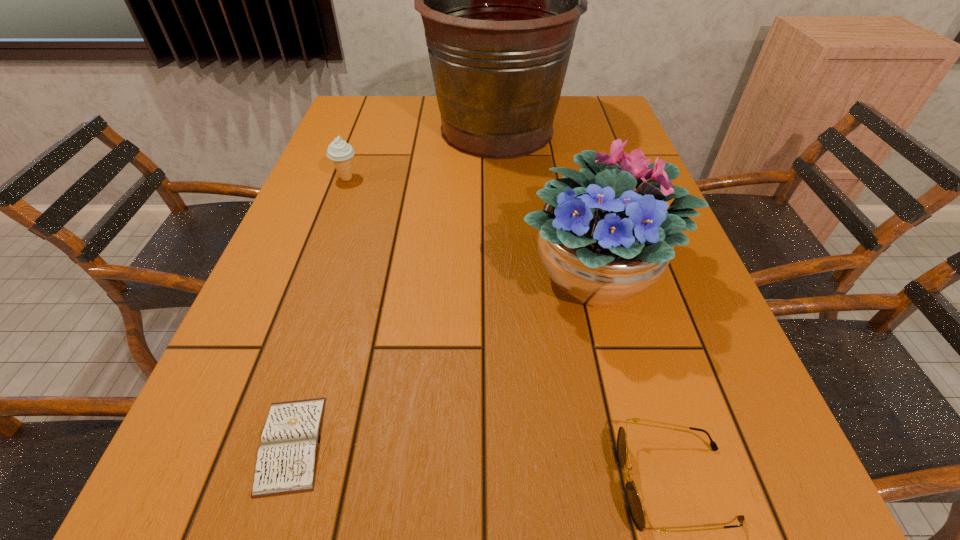
Select which object is the third closest to the icecream. Please provide its 2D coordinates. Your answer should be formatted as a tuple, i.e. [(x, y)], where the tuple contains the x and y coordinates of a point satisfying the conditions above.

[(286, 462)]

Locate an element on the screen. Image resolution: width=960 pixels, height=540 pixels. the second closest object to the shortest object is located at coordinates (634, 503).

I want to click on free location that satisfies the following two spatial constraints: 1. on the front side of the second tallest object; 2. on the left side of the farthest object, so click(505, 272).